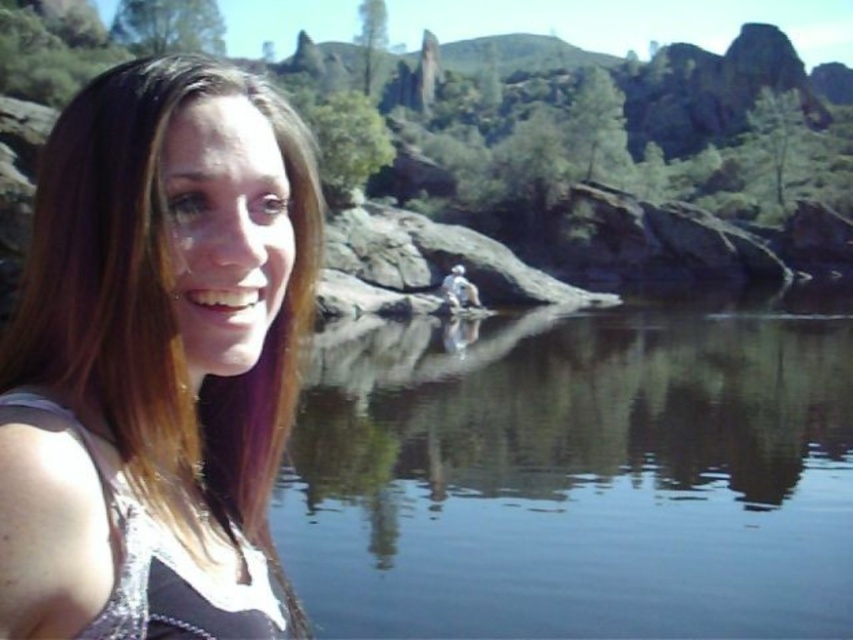
Who is shorter, clear water at center or white matte person at center?

With less height is white matte person at center.

Can you confirm if clear water at center is positioned below white matte person at center?

Yes, clear water at center is below white matte person at center.

Between point (415, 362) and point (467, 284), which one is positioned behind?

The point (467, 284) is behind.

You are a GUI agent. You are given a task and a screenshot of the screen. Output one action in this format:
    pyautogui.click(x=<x>, y=<y>)
    Task: Click on the clear water at center
    The image size is (853, 640).
    Given the screenshot: What is the action you would take?
    pyautogui.click(x=579, y=474)

Which is more to the left, clear water at center or shiny silver tank top at left?

shiny silver tank top at left is more to the left.

Which is above, clear water at center or shiny silver tank top at left?

shiny silver tank top at left is higher up.

You are a GUI agent. You are given a task and a screenshot of the screen. Output one action in this format:
    pyautogui.click(x=<x>, y=<y>)
    Task: Click on the clear water at center
    
    Given the screenshot: What is the action you would take?
    pyautogui.click(x=579, y=474)

Which is behind, point (286, 259) or point (460, 285)?

The point (460, 285) is behind.

Is point (225, 356) positioned before point (444, 301)?

Yes, point (225, 356) is in front of point (444, 301).

This screenshot has width=853, height=640. I want to click on shiny silver tank top at left, so click(x=155, y=358).